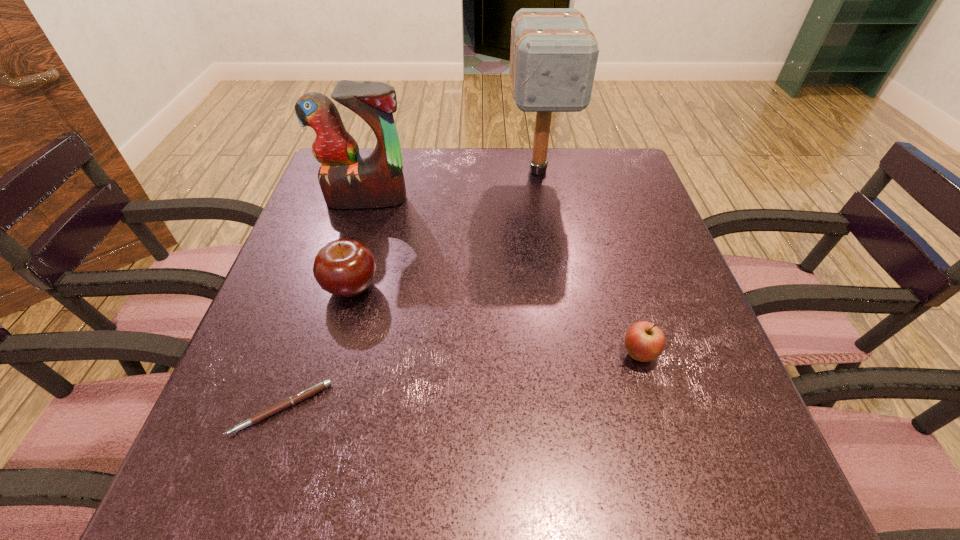
Find the location of a particular element. object that is at the far left corner is located at coordinates (347, 181).

In the image, there is a desktop. In order to click on free space at the far edge in this screenshot , I will do `click(444, 177)`.

In the image, there is a desktop. Where is `vacant space at the left edge`? vacant space at the left edge is located at coordinates 280,294.

In the image, there is a desktop. Where is `free space at the right edge`? free space at the right edge is located at coordinates (683, 313).

The image size is (960, 540). Find the location of `vacant region at the far right corner`. vacant region at the far right corner is located at coordinates (636, 179).

Locate an element on the screen. This screenshot has height=540, width=960. blank region between the fourth shortest object and the mallet is located at coordinates (452, 185).

Find the location of `free space between the second shortest object and the fourth shortest object`. free space between the second shortest object and the fourth shortest object is located at coordinates (502, 277).

Locate an element on the screen. The width and height of the screenshot is (960, 540). free space between the rightmost object and the pen is located at coordinates (460, 381).

The width and height of the screenshot is (960, 540). I want to click on free space between the nearer apple and the left apple, so click(x=495, y=321).

The height and width of the screenshot is (540, 960). In order to click on vacant space in between the nearest object and the fourth shortest object in this screenshot , I will do `click(324, 303)`.